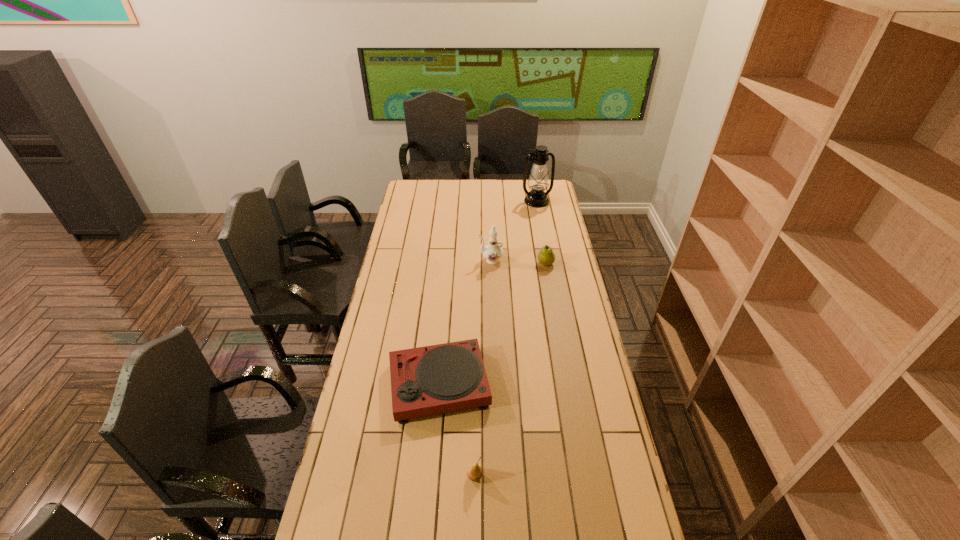
Find the location of a particular element. The width and height of the screenshot is (960, 540). free space located 0.110m at the spout of the chinaware is located at coordinates (455, 260).

Identify the location of vacant area situated at the spout of the chinaware. The image size is (960, 540). (448, 260).

Find the location of a particular element. The width and height of the screenshot is (960, 540). blank space located on the back of the third tallest object is located at coordinates (542, 248).

The height and width of the screenshot is (540, 960). I want to click on vacant region located 0.280m on the left of the shorter pear, so click(376, 477).

The image size is (960, 540). I want to click on blank area located 0.190m on the front of the fourth farthest object, so click(x=431, y=481).

In order to click on object present at the far edge in this screenshot , I will do `click(538, 181)`.

The image size is (960, 540). Find the location of `object present at the left edge`. object present at the left edge is located at coordinates (442, 378).

Identify the location of oil lamp positioned at the right edge. (538, 181).

Locate an element on the screen. pear that is at the right edge is located at coordinates (546, 256).

Locate an element on the screen. The image size is (960, 540). object positioned at the far right corner is located at coordinates (538, 181).